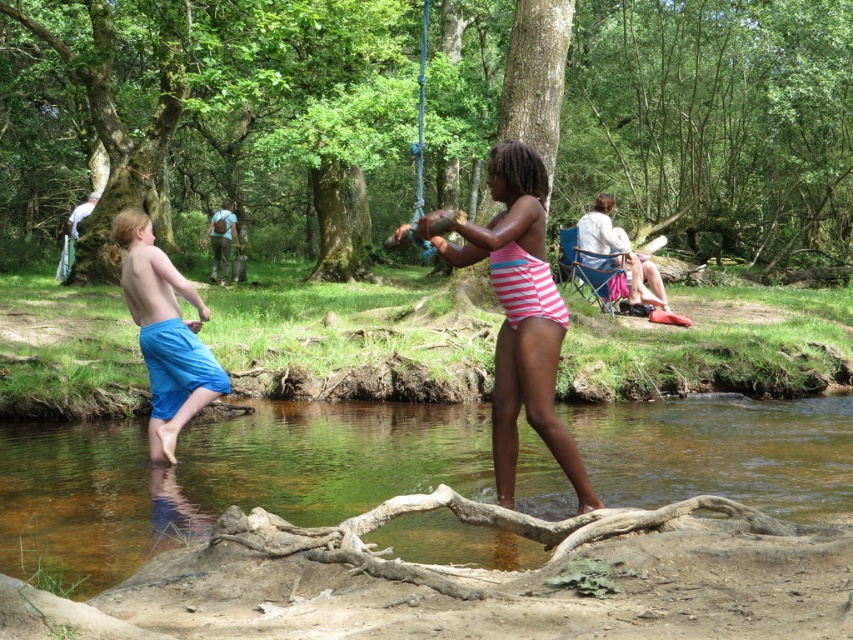
You are a hiker who wants to cross the stream safely. You see the clear water at stream center and the pink striped swimsuit at center. How far apart are these two points?

The clear water at stream center is 8.67 feet from the pink striped swimsuit at center, so the distance between them is 8.67 feet.

You are planning to cross the stream in the image. You see the clear water at stream center and the blue fabric shorts at left. Which object is smaller in size?

The clear water at stream center has a smaller size compared to the blue fabric shorts at left, so the clear water at stream center is smaller in size.

You are standing at the point marked as point (4, 472) in the image. You want to cross the stream to the other side. The stream is 15 feet wide. Can you safely cross the stream without getting wet?

The distance between you and the viewer is 27.55 feet, but the stream is only 15 feet wide. Therefore, you can safely cross the stream without getting wet by moving sideways along the bank until you find a point where the stream is narrower or dry land, as the total distance from your current position to the viewer is greater than the stream width.